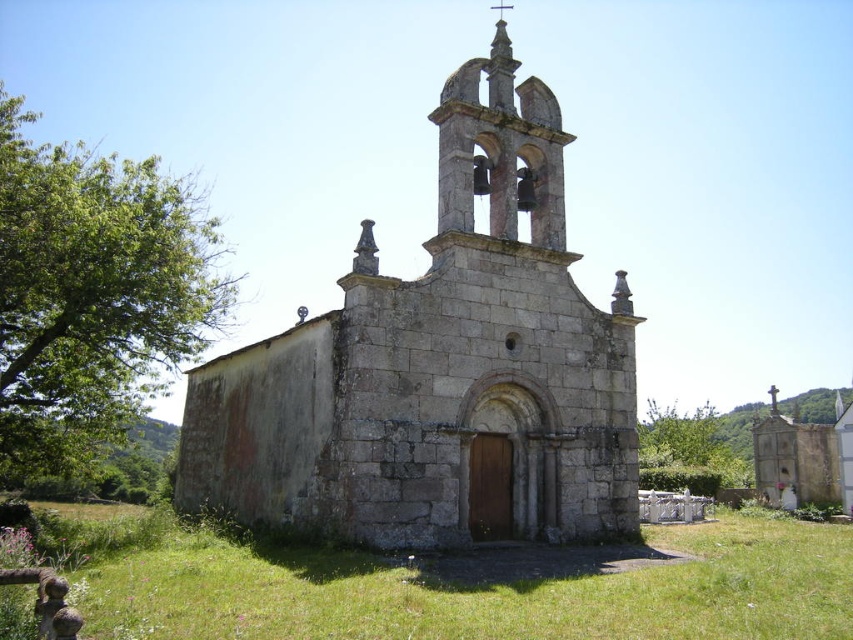
Question: In this image, where is stone church at center located relative to green grass at lower center?

Choices:
 (A) below
 (B) above

Answer: (B)

Question: Does stone church at center have a smaller size compared to green grass at lower center?

Choices:
 (A) no
 (B) yes

Answer: (A)

Question: Does stone church at center appear over green grass at lower center?

Choices:
 (A) no
 (B) yes

Answer: (B)